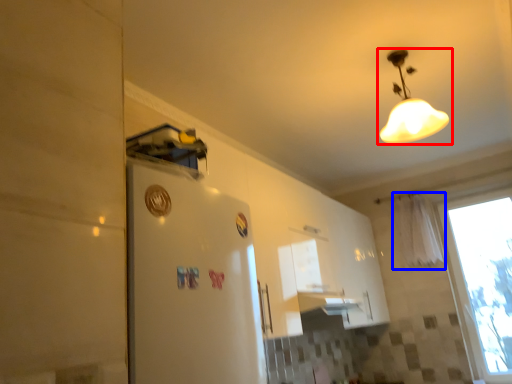
Question: Which point is closer to the camera, lamp (highlighted by a red box) or curtain (highlighted by a blue box)?

Choices:
 (A) lamp
 (B) curtain

Answer: (A)